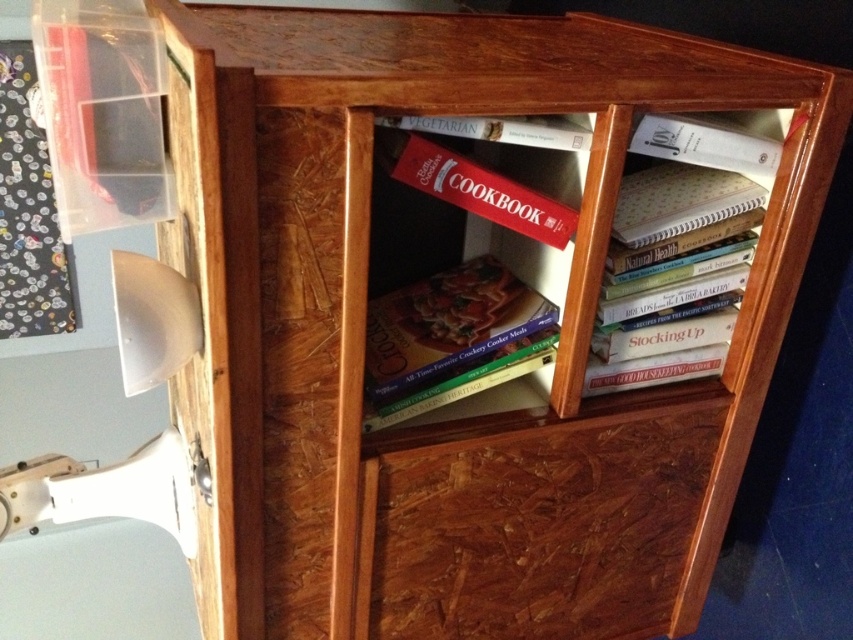
Question: Does wooden drawer at center appear on the left side of white paper at upper right?

Choices:
 (A) yes
 (B) no

Answer: (A)

Question: In this image, where is wooden drawer at center located relative to white paper notebook at right?

Choices:
 (A) right
 (B) left

Answer: (B)

Question: Estimate the real-world distances between objects in this image. Which object is closer to the red matte cookbook at upper center?

Choices:
 (A) white paper notebook at right
 (B) wooden drawer at center

Answer: (A)

Question: Which of the following is the farthest from the observer?

Choices:
 (A) (422, 189)
 (B) (656, 131)

Answer: (B)

Question: Which object is farther from the camera taking this photo?

Choices:
 (A) matte red cookbook at center
 (B) matte hardcover cookbook at center
 (C) red matte cookbook at upper center
 (D) white paper at upper right

Answer: (B)

Question: From the image, what is the correct spatial relationship of matte hardcover cookbook at center in relation to white paper at upper right?

Choices:
 (A) right
 (B) left

Answer: (B)